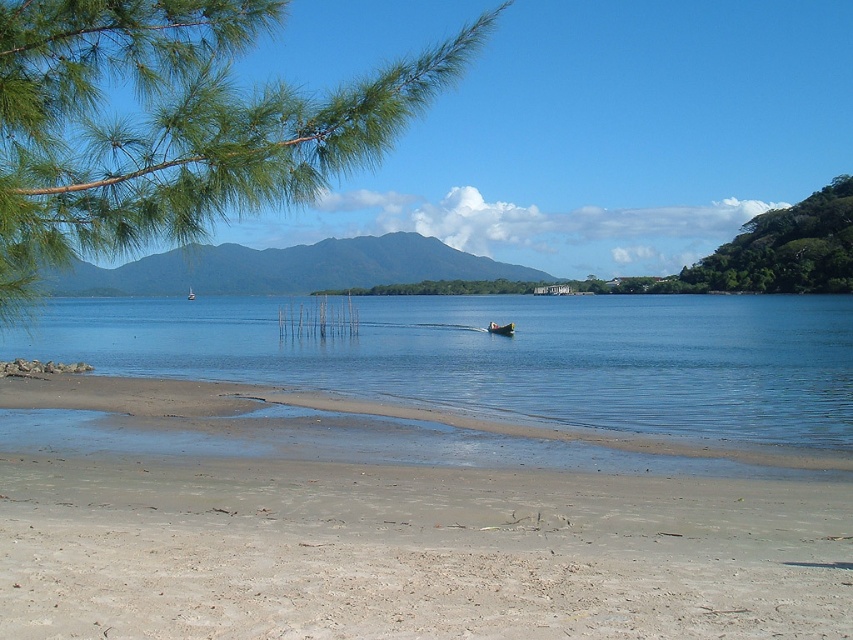
You are standing on the beach and want to take a photo of the wooden boat at center without the green leafy branch at upper left blocking the view. Which direction should you move to ensure the branch is out of frame?

Move to the right so that the green leafy branch at upper left is no longer in front of the wooden boat at center.

You are standing on the beach and want to take a photo of the wooden boat at center. Since the clear blue water at center is between you and the boat, will the water block your view of the boat?

The clear blue water at center is in front of the wooden boat at center, so it will block your view of the wooden boat at center.

You are standing on the beach and want to take a photo of the green leafy branch at upper left. The camera you are using has a maximum focus range of 6 meters. Will the camera be able to focus on the branch?

The green leafy branch at upper left is 6.47 meters away from the camera. Since the camera can only focus up to 6 meters, it will not be able to focus on the branch.